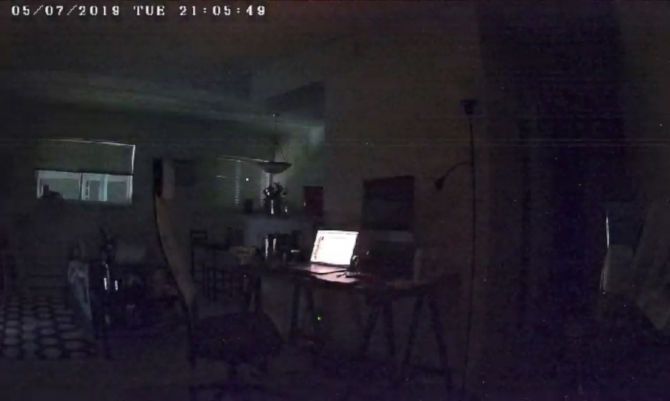
The height and width of the screenshot is (401, 670). I want to click on place to sit, so click(x=247, y=332).